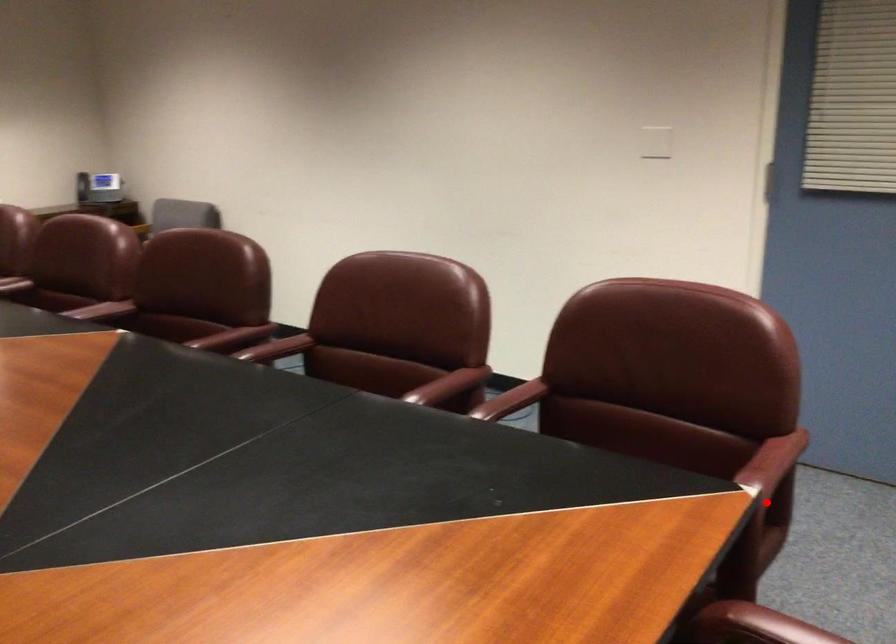
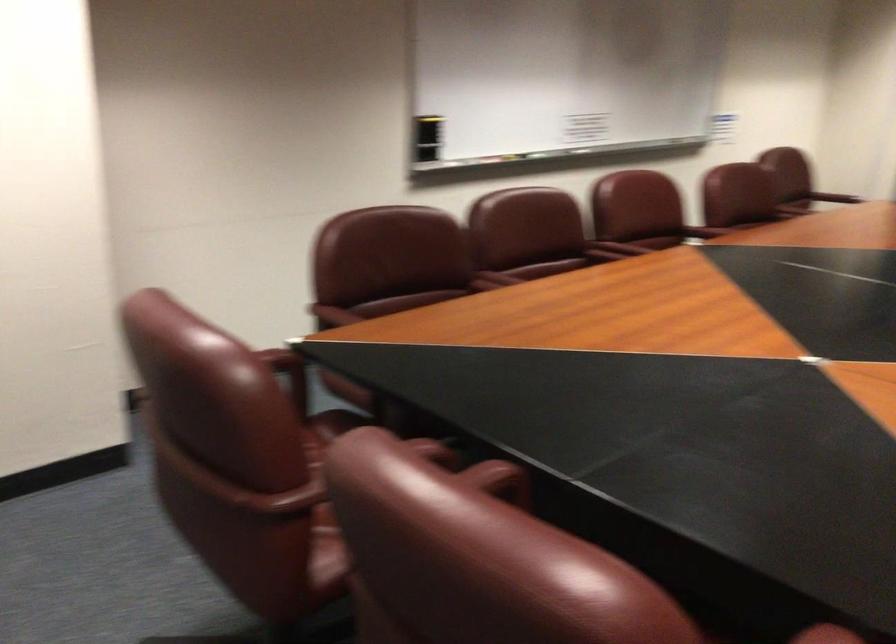
Locate, in the second image, the point that corresponds to the highlighted location in the first image.

(289, 374)